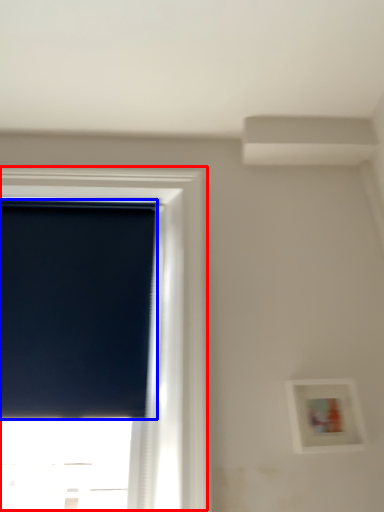
Question: Which object appears farthest to the camera in this image, window (highlighted by a red box) or window screen (highlighted by a blue box)?

Choices:
 (A) window
 (B) window screen

Answer: (B)